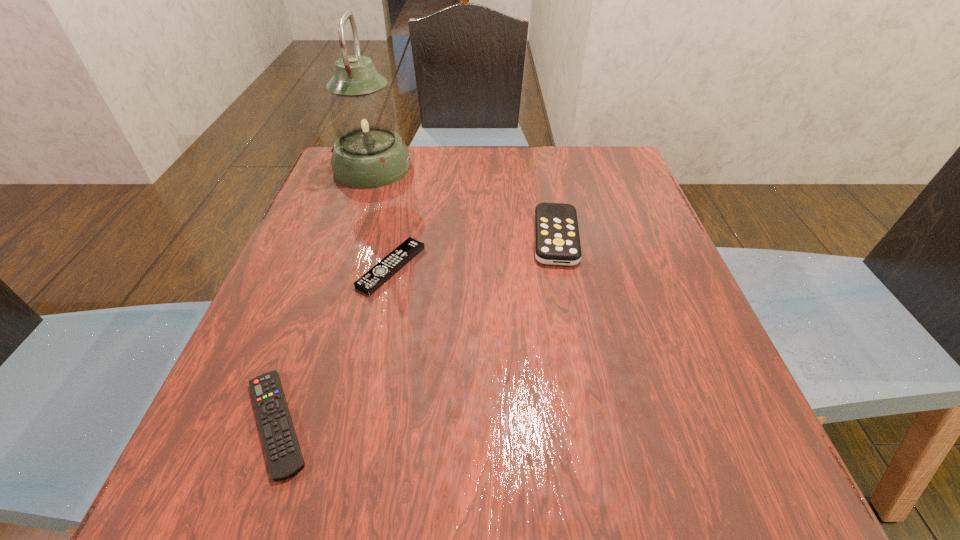
You are a GUI agent. You are given a task and a screenshot of the screen. Output one action in this format:
    pyautogui.click(x=<x>, y=<y>)
    Task: Click on the lantern that is at the left edge
    This screenshot has width=960, height=540.
    Given the screenshot: What is the action you would take?
    pyautogui.click(x=368, y=153)

You are a GUI agent. You are given a task and a screenshot of the screen. Output one action in this format:
    pyautogui.click(x=<x>, y=<y>)
    Task: Click on the object located in the far left corner section of the desktop
    Image resolution: width=960 pixels, height=540 pixels.
    Given the screenshot: What is the action you would take?
    pyautogui.click(x=368, y=153)

Where is `object that is at the near left corner`? object that is at the near left corner is located at coordinates (284, 457).

In the image, there is a desktop. Where is `free space at the far edge`? Image resolution: width=960 pixels, height=540 pixels. free space at the far edge is located at coordinates click(500, 145).

In the image, there is a desktop. Identify the location of vacant region at the near edge. (411, 480).

I want to click on free space at the left edge, so click(347, 222).

In the image, there is a desktop. Identify the location of vacant area at the right edge. Image resolution: width=960 pixels, height=540 pixels. (624, 216).

This screenshot has width=960, height=540. I want to click on vacant space at the far right corner, so click(593, 151).

I want to click on vacant space that's between the rightmost remote control and the nearest object, so click(x=416, y=330).

Identify the location of empty space that is in between the nearest object and the tallest remote control. (416, 330).